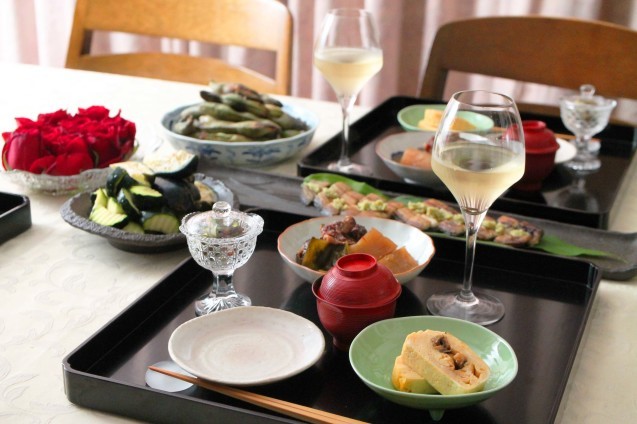
Find the location of a particular element. The width and height of the screenshot is (637, 424). goblets is located at coordinates (471, 167), (347, 53).